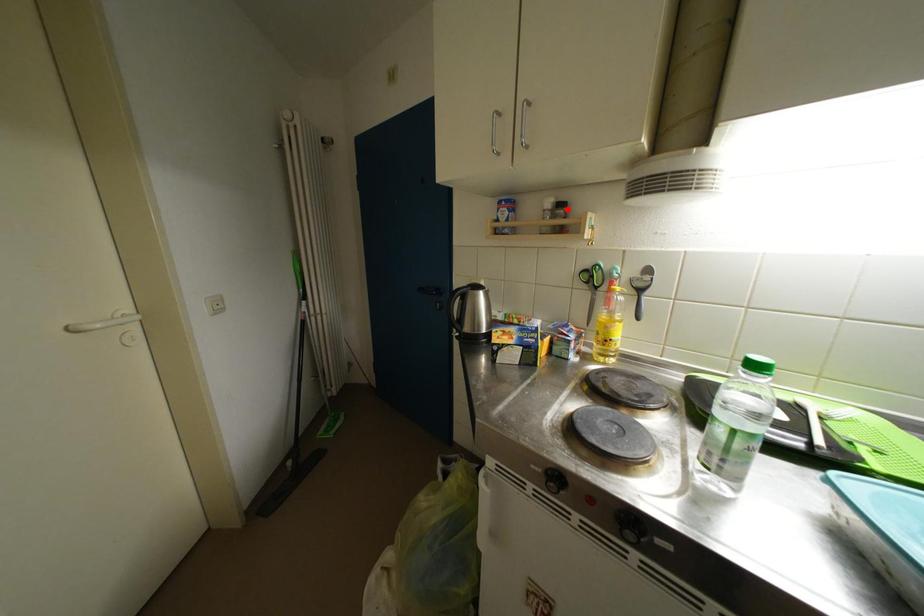
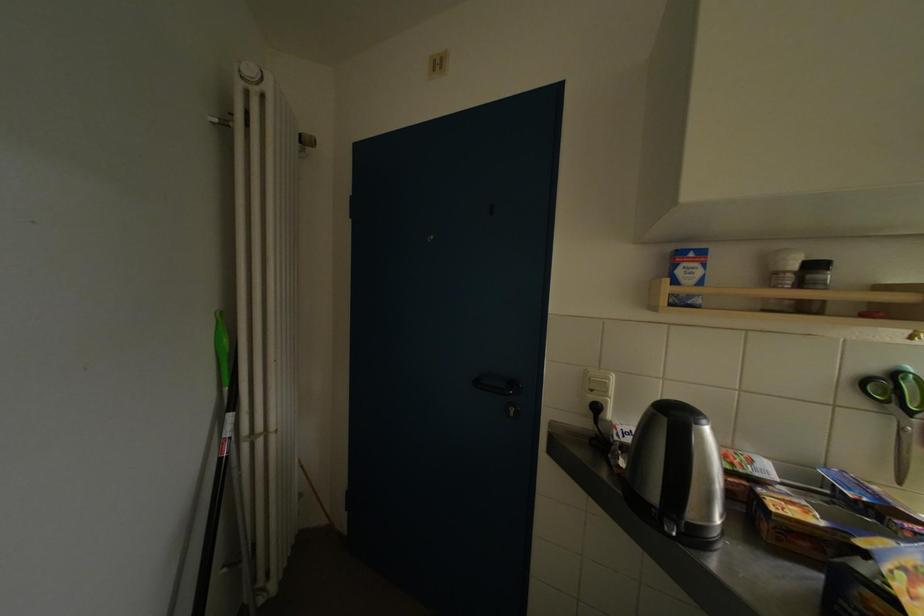
Question: I am providing you with two images of the same scene from different viewpoints. A red point is marked on the first image. Is the red point's position out of view in image 2?

Choices:
 (A) Yes
 (B) No

Answer: (B)